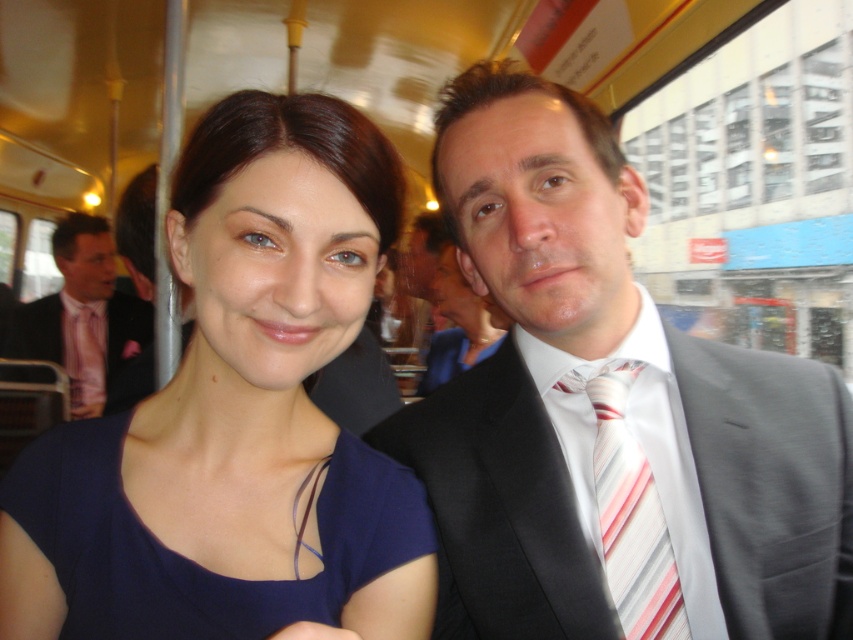
You are a photographer trying to capture a closeup shot of the two people seated in the public transport vehicle. You are currently positioned at point (814, 609). The camera you are using has a minimum focusing distance of 24 inches. Will you be able to take a clear photo of them from your current position?

The distance between point (814, 609) and the camera is 26.09 inches. Since the minimum focusing distance is 24 inches, you are slightly too far away to capture a clear photo. Move closer by approximately 2 inches to ensure proper focus.

You are a passenger on a tram and want to place a small bag between the two points marked as point (430, 522) and point (647, 480). Which point should you place the bag closer to in order to keep it nearer to you?

You should place the bag closer to point (430, 522) because it is nearer to you than point (647, 480).